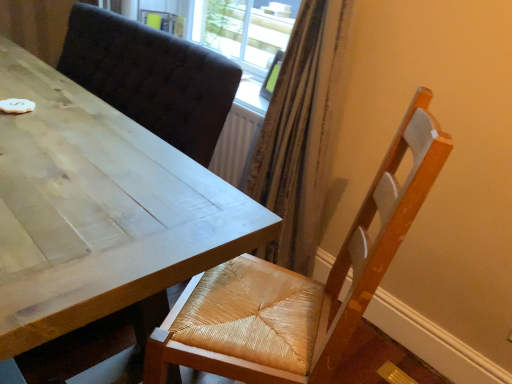
At what (x,y) coordinates should I click in order to perform the action: click on free space above light wood table at upper left (from a real-world perspective). Please return your answer as a coordinate pair (x, y). The height and width of the screenshot is (384, 512). Looking at the image, I should click on (61, 132).